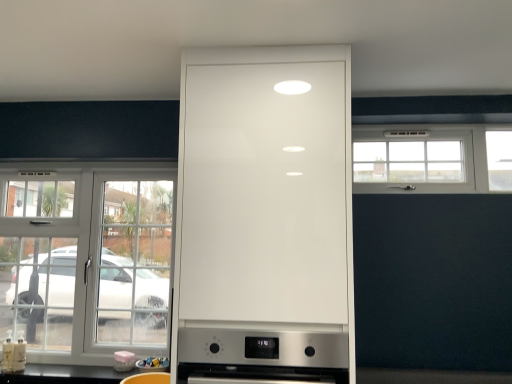
Question: Is white glass window at left, the first window positioned from the left, at the right side of matte plastic container at lower center, marked as the first appliance in a right-to-left arrangement?

Choices:
 (A) no
 (B) yes

Answer: (A)

Question: Would you say white glass window at left, the first window positioned from the left, contains matte plastic container at lower center, arranged as the second appliance when viewed from the left?

Choices:
 (A) no
 (B) yes

Answer: (A)

Question: Would you consider white glass window at left, acting as the 2th window starting from the right, to be distant from matte plastic container at lower center, marked as the first appliance in a right-to-left arrangement?

Choices:
 (A) yes
 (B) no

Answer: (B)

Question: Does white glass window at left, which is the 2th window from top to bottom, have a greater height compared to matte plastic container at lower center, arranged as the second appliance when viewed from the left?

Choices:
 (A) yes
 (B) no

Answer: (A)

Question: Could you tell me if white glass window at left, acting as the 2th window starting from the right, is turned towards matte plastic container at lower center, arranged as the second appliance when viewed from the left?

Choices:
 (A) no
 (B) yes

Answer: (B)

Question: Considering their positions, is white glass window at left, acting as the 2th window starting from the right, located in front of or behind white glossy cabinet at center?

Choices:
 (A) behind
 (B) front

Answer: (A)

Question: Does point (160, 294) appear closer or farther from the camera than point (310, 326)?

Choices:
 (A) closer
 (B) farther

Answer: (B)

Question: Is white glass window at left, the 1th window ordered from the bottom, to the left or to the right of white glossy cabinet at center in the image?

Choices:
 (A) right
 (B) left

Answer: (B)

Question: Looking at their shapes, would you say white glass window at left, acting as the 2th window starting from the right, is wider or thinner than white glossy cabinet at center?

Choices:
 (A) thin
 (B) wide

Answer: (A)

Question: From a real-world perspective, relative to white glossy cup at lower center, which is counted as the second appliance, starting from the right, is white plastic window at upper right, which is the 1th window in top-to-bottom order, vertically above or below?

Choices:
 (A) above
 (B) below

Answer: (A)

Question: Is point (496, 132) closer or farther from the camera than point (117, 367)?

Choices:
 (A) farther
 (B) closer

Answer: (A)

Question: Would you say white plastic window at upper right, which is the 2th window from left to right, is inside or outside white glossy cup at lower center, which is counted as the second appliance, starting from the right?

Choices:
 (A) outside
 (B) inside

Answer: (A)

Question: In terms of height, does white plastic window at upper right, which is the 1th window in top-to-bottom order, look taller or shorter compared to white glossy cup at lower center, which is counted as the second appliance, starting from the right?

Choices:
 (A) tall
 (B) short

Answer: (A)

Question: From a real-world perspective, is white glossy cup at lower center, positioned as the first appliance in left-to-right order, above or below white glossy cabinet at center?

Choices:
 (A) above
 (B) below

Answer: (B)

Question: Is white glossy cup at lower center, which is counted as the second appliance, starting from the right, spatially inside white glossy cabinet at center, or outside of it?

Choices:
 (A) outside
 (B) inside

Answer: (A)